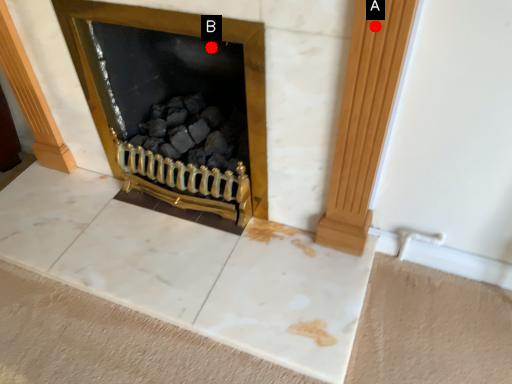
Question: Two points are circled on the image, labeled by A and B beside each circle. Which point is closer to the camera?

Choices:
 (A) A is closer
 (B) B is closer

Answer: (A)